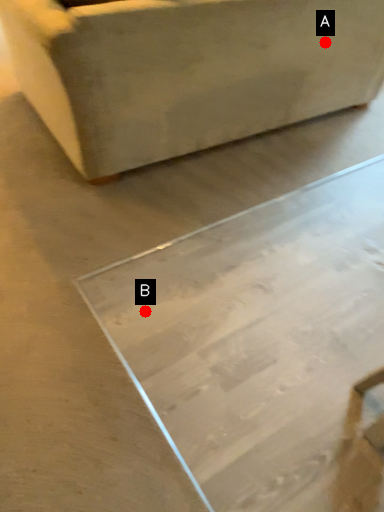
Question: Two points are circled on the image, labeled by A and B beside each circle. Which point is farther from the camera taking this photo?

Choices:
 (A) A is further
 (B) B is further

Answer: (A)